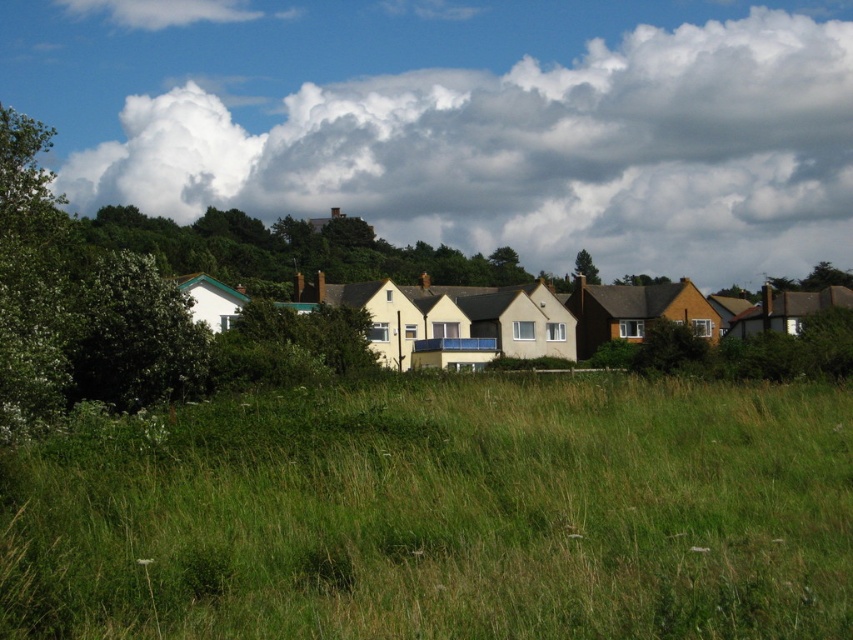
Between green grass at center and white fluffy cloud at upper center, which one appears on the right side from the viewer's perspective?

green grass at center is more to the right.

Can you confirm if green grass at center is smaller than white fluffy cloud at upper center?

Correct, green grass at center occupies less space than white fluffy cloud at upper center.

Does point (144, 588) lie behind point (724, 212)?

No, (144, 588) is in front of (724, 212).

You are a GUI agent. You are given a task and a screenshot of the screen. Output one action in this format:
    pyautogui.click(x=<x>, y=<y>)
    Task: Click on the green grass at center
    
    Given the screenshot: What is the action you would take?
    pyautogui.click(x=445, y=515)

How much distance is there between green grass at center and green leafy tree at center?

A distance of 309.09 feet exists between green grass at center and green leafy tree at center.

Is green grass at center positioned at the back of green leafy tree at center?

No, it is not.

This screenshot has height=640, width=853. What do you see at coordinates (445, 515) in the screenshot? I see `green grass at center` at bounding box center [445, 515].

Locate an element on the screen. This screenshot has width=853, height=640. green grass at center is located at coordinates (x=445, y=515).

Locate an element on the screen. white fluffy cloud at upper center is located at coordinates (473, 124).

This screenshot has width=853, height=640. Identify the location of white fluffy cloud at upper center. (473, 124).